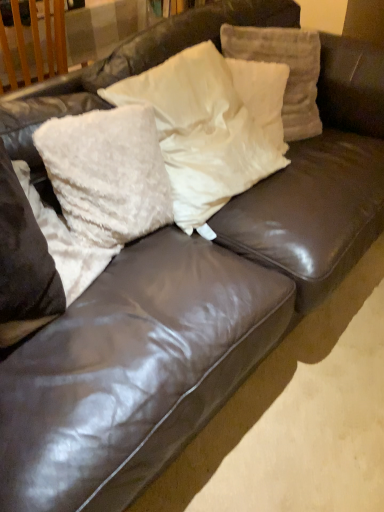
What do you see at coordinates (65, 243) in the screenshot?
I see `white fluffy pillow at left, which is the first pillow from left to right` at bounding box center [65, 243].

What is the approximate width of white fluffy pillow at upper center, which is the fifth pillow in left-to-right order?

It is 29.68 centimeters.

You are a GUI agent. You are given a task and a screenshot of the screen. Output one action in this format:
    pyautogui.click(x=<x>, y=<y>)
    Task: Click on the white fluffy pillow at upper center, the 1th pillow positioned from the right
    Image resolution: width=384 pixels, height=512 pixels.
    Given the screenshot: What is the action you would take?
    pyautogui.click(x=289, y=70)

Find the location of a particular element. This screenshot has height=512, width=384. white fluffy pillow at center, arranged as the 2th pillow when viewed from the left is located at coordinates (107, 173).

This screenshot has width=384, height=512. What are the coordinates of `pillow that is the 3rd object to the left of the white fluffy pillow at upper center, positioned as the fourth pillow in left-to-right order, starting at the anchor` in the screenshot? It's located at (65, 243).

Which object is positioned more to the right, white fluffy pillow at upper center, positioned as the fourth pillow in left-to-right order, or white fluffy pillow at left, arranged as the fifth pillow when viewed from the right?

white fluffy pillow at upper center, positioned as the fourth pillow in left-to-right order.

Is white fluffy pillow at upper center, positioned as the fourth pillow in left-to-right order, touching white fluffy pillow at left, which is the first pillow from left to right?

No, white fluffy pillow at upper center, positioned as the fourth pillow in left-to-right order, is not next to white fluffy pillow at left, which is the first pillow from left to right.

Considering the sizes of white fluffy pillow at upper center, positioned as the fourth pillow in left-to-right order, and white fluffy pillow at left, arranged as the fifth pillow when viewed from the right, in the image, is white fluffy pillow at upper center, positioned as the fourth pillow in left-to-right order, wider or thinner than white fluffy pillow at left, arranged as the fifth pillow when viewed from the right,?

Clearly, white fluffy pillow at upper center, positioned as the fourth pillow in left-to-right order, has less width compared to white fluffy pillow at left, arranged as the fifth pillow when viewed from the right.

Where is `the 2nd pillow in front when counting from the white fluffy pillow at center, marked as the 3th pillow in a right-to-left arrangement`? Image resolution: width=384 pixels, height=512 pixels. the 2nd pillow in front when counting from the white fluffy pillow at center, marked as the 3th pillow in a right-to-left arrangement is located at coordinates (65, 243).

Based on the photo, from a real-world perspective, is white fluffy pillow at center, marked as the 3th pillow in a right-to-left arrangement, located beneath white fluffy pillow at left, arranged as the fifth pillow when viewed from the right?

Incorrect, from a real-world perspective, white fluffy pillow at center, marked as the 3th pillow in a right-to-left arrangement, is higher than white fluffy pillow at left, arranged as the fifth pillow when viewed from the right.

Who is bigger, white fluffy pillow at center, the 3th pillow positioned from the left, or white fluffy pillow at left, which is the first pillow from left to right?

white fluffy pillow at center, the 3th pillow positioned from the left.

Considering the sizes of white fluffy pillow at center, the 3th pillow positioned from the left, and white fluffy pillow at left, which is the first pillow from left to right, in the image, is white fluffy pillow at center, the 3th pillow positioned from the left, taller or shorter than white fluffy pillow at left, which is the first pillow from left to right,?

In the image, white fluffy pillow at center, the 3th pillow positioned from the left, appears to be taller than white fluffy pillow at left, which is the first pillow from left to right.

Considering the sizes of objects white fluffy pillow at center, arranged as the 2th pillow when viewed from the left, and white fluffy pillow at center, the 3th pillow positioned from the left, in the image provided, who is thinner, white fluffy pillow at center, arranged as the 2th pillow when viewed from the left, or white fluffy pillow at center, the 3th pillow positioned from the left,?

Thinner between the two is white fluffy pillow at center, arranged as the 2th pillow when viewed from the left.

Considering the relative positions of white fluffy pillow at center, marked as the 4th pillow in a right-to-left arrangement, and white fluffy pillow at center, marked as the 3th pillow in a right-to-left arrangement, in the image provided, is white fluffy pillow at center, marked as the 4th pillow in a right-to-left arrangement, to the right of white fluffy pillow at center, marked as the 3th pillow in a right-to-left arrangement, from the viewer's perspective?

In fact, white fluffy pillow at center, marked as the 4th pillow in a right-to-left arrangement, is to the left of white fluffy pillow at center, marked as the 3th pillow in a right-to-left arrangement.

From the picture: Is white fluffy pillow at center, marked as the 4th pillow in a right-to-left arrangement, positioned with its back to white fluffy pillow at center, the 3th pillow positioned from the left?

white fluffy pillow at center, marked as the 4th pillow in a right-to-left arrangement, does not have its back to white fluffy pillow at center, the 3th pillow positioned from the left.

Is white fluffy pillow at center, arranged as the 2th pillow when viewed from the left, inside white fluffy pillow at center, the 3th pillow positioned from the left?

Actually, white fluffy pillow at center, arranged as the 2th pillow when viewed from the left, is outside white fluffy pillow at center, the 3th pillow positioned from the left.

Does white fluffy pillow at center, marked as the 3th pillow in a right-to-left arrangement, have a larger size compared to white fluffy pillow at center, arranged as the 2th pillow when viewed from the left?

Yes.

Which is nearer, (178, 84) or (143, 106)?

Point (178, 84) is positioned farther from the camera compared to point (143, 106).

Is white fluffy pillow at center, marked as the 4th pillow in a right-to-left arrangement, located within white fluffy pillow at left, arranged as the fifth pillow when viewed from the right?

No, white fluffy pillow at center, marked as the 4th pillow in a right-to-left arrangement, is located outside of white fluffy pillow at left, arranged as the fifth pillow when viewed from the right.

Is white fluffy pillow at left, arranged as the fifth pillow when viewed from the right, at the right side of white fluffy pillow at center, marked as the 4th pillow in a right-to-left arrangement?

No, white fluffy pillow at left, arranged as the fifth pillow when viewed from the right, is not to the right of white fluffy pillow at center, marked as the 4th pillow in a right-to-left arrangement.

Is the surface of white fluffy pillow at left, arranged as the fifth pillow when viewed from the right, in direct contact with white fluffy pillow at center, arranged as the 2th pillow when viewed from the left?

They are not placed beside each other.

What's the angular difference between white fluffy pillow at left, which is the first pillow from left to right, and white fluffy pillow at center, marked as the 4th pillow in a right-to-left arrangement,'s facing directions?

white fluffy pillow at left, which is the first pillow from left to right, and white fluffy pillow at center, marked as the 4th pillow in a right-to-left arrangement, are facing 19.3 degrees away from each other.

Which of these two, white fluffy pillow at center, marked as the 4th pillow in a right-to-left arrangement, or white fluffy pillow at left, which is the first pillow from left to right, is smaller?

white fluffy pillow at center, marked as the 4th pillow in a right-to-left arrangement.

From a real-world perspective, between white fluffy pillow at center, arranged as the 2th pillow when viewed from the left, and white fluffy pillow at left, arranged as the fifth pillow when viewed from the right, who is vertically lower?

From a 3D spatial view, white fluffy pillow at left, arranged as the fifth pillow when viewed from the right, is below.

Is white fluffy pillow at center, marked as the 4th pillow in a right-to-left arrangement, next to white fluffy pillow at left, which is the first pillow from left to right?

There is a gap between white fluffy pillow at center, marked as the 4th pillow in a right-to-left arrangement, and white fluffy pillow at left, which is the first pillow from left to right.

In terms of height, does white fluffy pillow at center, arranged as the 2th pillow when viewed from the left, look taller or shorter compared to white fluffy pillow at left, arranged as the fifth pillow when viewed from the right?

Considering their sizes, white fluffy pillow at center, arranged as the 2th pillow when viewed from the left, has more height than white fluffy pillow at left, arranged as the fifth pillow when viewed from the right.

Does white fluffy pillow at upper center, which is the fifth pillow in left-to-right order, have a lesser width compared to white fluffy pillow at center, arranged as the 2th pillow when viewed from the left?

Incorrect, the width of white fluffy pillow at upper center, which is the fifth pillow in left-to-right order, is not less than that of white fluffy pillow at center, arranged as the 2th pillow when viewed from the left.

From the image's perspective, is white fluffy pillow at upper center, which is the fifth pillow in left-to-right order, located beneath white fluffy pillow at center, arranged as the 2th pillow when viewed from the left?

No.

Is white fluffy pillow at center, arranged as the 2th pillow when viewed from the left, located within white fluffy pillow at upper center, which is the fifth pillow in left-to-right order?

No, white fluffy pillow at upper center, which is the fifth pillow in left-to-right order, does not contain white fluffy pillow at center, arranged as the 2th pillow when viewed from the left.

Can you confirm if white fluffy pillow at upper center, the 1th pillow positioned from the right, is shorter than white fluffy pillow at center, marked as the 4th pillow in a right-to-left arrangement?

No, white fluffy pillow at upper center, the 1th pillow positioned from the right, is not shorter than white fluffy pillow at center, marked as the 4th pillow in a right-to-left arrangement.

From the image's perspective, which pillow is the 3rd one below the white fluffy pillow at upper center, arranged as the 2th pillow when viewed from the right? Please provide its 2D coordinates.

[(65, 243)]

The height and width of the screenshot is (512, 384). There is a white fluffy pillow at left, arranged as the fifth pillow when viewed from the right. In order to click on the 2nd pillow above it (from the image's perspective) in this screenshot , I will do `click(211, 126)`.

Considering their positions, is white fluffy pillow at center, the 3th pillow positioned from the left, positioned further to white fluffy pillow at left, which is the first pillow from left to right, than white fluffy pillow at upper center, the 1th pillow positioned from the right?

white fluffy pillow at upper center, the 1th pillow positioned from the right, is further to white fluffy pillow at left, which is the first pillow from left to right.

Which object lies further to the anchor point white fluffy pillow at upper center, arranged as the 2th pillow when viewed from the right, white fluffy pillow at center, marked as the 3th pillow in a right-to-left arrangement, or white fluffy pillow at center, arranged as the 2th pillow when viewed from the left?

white fluffy pillow at center, arranged as the 2th pillow when viewed from the left, lies further to white fluffy pillow at upper center, arranged as the 2th pillow when viewed from the right, than the other object.

Considering their positions, is white fluffy pillow at upper center, positioned as the fourth pillow in left-to-right order, positioned further to white fluffy pillow at left, arranged as the fifth pillow when viewed from the right, than white fluffy pillow at center, marked as the 4th pillow in a right-to-left arrangement?

white fluffy pillow at upper center, positioned as the fourth pillow in left-to-right order, is positioned further to the anchor white fluffy pillow at left, arranged as the fifth pillow when viewed from the right.

From the image, which object appears to be nearer to white fluffy pillow at center, marked as the 3th pillow in a right-to-left arrangement, white fluffy pillow at center, arranged as the 2th pillow when viewed from the left, or white fluffy pillow at upper center, which is the fifth pillow in left-to-right order?

white fluffy pillow at center, arranged as the 2th pillow when viewed from the left, is closer to white fluffy pillow at center, marked as the 3th pillow in a right-to-left arrangement.

Based on their spatial positions, is white fluffy pillow at left, which is the first pillow from left to right, or white fluffy pillow at center, arranged as the 2th pillow when viewed from the left, closer to white fluffy pillow at upper center, positioned as the fourth pillow in left-to-right order?

The object closer to white fluffy pillow at upper center, positioned as the fourth pillow in left-to-right order, is white fluffy pillow at center, arranged as the 2th pillow when viewed from the left.

Which object lies further to the anchor point white fluffy pillow at upper center, arranged as the 2th pillow when viewed from the right, white fluffy pillow at center, marked as the 4th pillow in a right-to-left arrangement, or white fluffy pillow at upper center, which is the fifth pillow in left-to-right order?

white fluffy pillow at center, marked as the 4th pillow in a right-to-left arrangement, lies further to white fluffy pillow at upper center, arranged as the 2th pillow when viewed from the right, than the other object.

From the image, which object appears to be farther from white fluffy pillow at upper center, the 1th pillow positioned from the right, white fluffy pillow at upper center, arranged as the 2th pillow when viewed from the right, or white fluffy pillow at left, which is the first pillow from left to right?

Among the two, white fluffy pillow at left, which is the first pillow from left to right, is located further to white fluffy pillow at upper center, the 1th pillow positioned from the right.

Based on their spatial positions, is white fluffy pillow at upper center, arranged as the 2th pillow when viewed from the right, or white fluffy pillow at center, marked as the 3th pillow in a right-to-left arrangement, closer to white fluffy pillow at upper center, which is the fifth pillow in left-to-right order?

Result: white fluffy pillow at upper center, arranged as the 2th pillow when viewed from the right.

Where is `pillow between white fluffy pillow at center, the 3th pillow positioned from the left, and white fluffy pillow at upper center, positioned as the fourth pillow in left-to-right order, along the z-axis`? This screenshot has height=512, width=384. pillow between white fluffy pillow at center, the 3th pillow positioned from the left, and white fluffy pillow at upper center, positioned as the fourth pillow in left-to-right order, along the z-axis is located at coordinates (289, 70).

At what (x,y) coordinates should I click in order to perform the action: click on pillow situated between white fluffy pillow at center, arranged as the 2th pillow when viewed from the left, and white fluffy pillow at upper center, arranged as the 2th pillow when viewed from the right, from left to right. Please return your answer as a coordinate pair (x, y). Image resolution: width=384 pixels, height=512 pixels. Looking at the image, I should click on (211, 126).

Locate an element on the screen. The width and height of the screenshot is (384, 512). pillow between white fluffy pillow at left, which is the first pillow from left to right, and white fluffy pillow at center, the 3th pillow positioned from the left, from left to right is located at coordinates (107, 173).